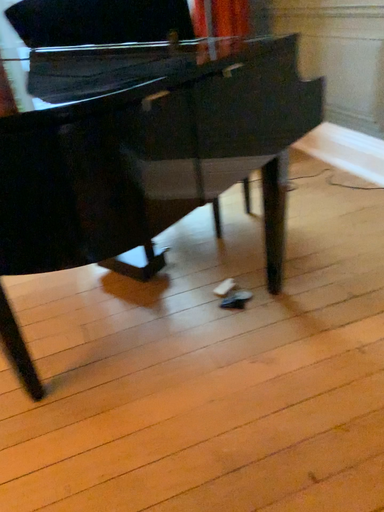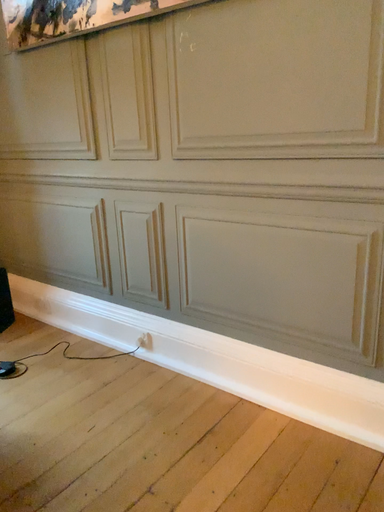
Question: Which way did the camera rotate in the video?

Choices:
 (A) rotated upward
 (B) rotated downward

Answer: (A)